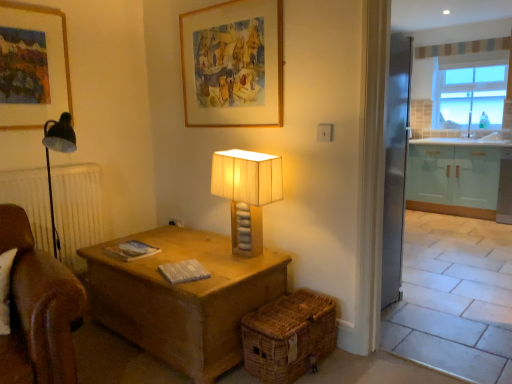
Question: From the image's perspective, is white glossy sink at right on clear glass window at upper right?

Choices:
 (A) no
 (B) yes

Answer: (A)

Question: Can we say white glossy sink at right lies outside clear glass window at upper right?

Choices:
 (A) yes
 (B) no

Answer: (A)

Question: Is white glossy sink at right closer to camera compared to clear glass window at upper right?

Choices:
 (A) yes
 (B) no

Answer: (A)

Question: Is white glossy sink at right positioned with its back to clear glass window at upper right?

Choices:
 (A) no
 (B) yes

Answer: (A)

Question: Can you confirm if white glossy sink at right is shorter than clear glass window at upper right?

Choices:
 (A) yes
 (B) no

Answer: (A)

Question: Is clear glass window at upper right taller or shorter than wooden table lamp at center?

Choices:
 (A) tall
 (B) short

Answer: (A)

Question: Considering their positions, is clear glass window at upper right located in front of or behind wooden table lamp at center?

Choices:
 (A) behind
 (B) front

Answer: (A)

Question: In terms of width, does clear glass window at upper right look wider or thinner when compared to wooden table lamp at center?

Choices:
 (A) thin
 (B) wide

Answer: (B)

Question: From a real-world perspective, is clear glass window at upper right physically located above or below wooden table lamp at center?

Choices:
 (A) below
 (B) above

Answer: (B)

Question: From a real-world perspective, is woven brown basket at lower center positioned above or below white glossy sink at right?

Choices:
 (A) above
 (B) below

Answer: (B)

Question: In terms of size, does woven brown basket at lower center appear bigger or smaller than white glossy sink at right?

Choices:
 (A) small
 (B) big

Answer: (B)

Question: Considering the positions of woven brown basket at lower center and white glossy sink at right in the image, is woven brown basket at lower center wider or thinner than white glossy sink at right?

Choices:
 (A) thin
 (B) wide

Answer: (B)

Question: Would you say woven brown basket at lower center is to the left or to the right of white glossy sink at right in the picture?

Choices:
 (A) left
 (B) right

Answer: (A)

Question: Relative to clear glass window at upper right, is woven brown basket at lower center in front or behind?

Choices:
 (A) front
 (B) behind

Answer: (A)

Question: Is woven brown basket at lower center to the left or to the right of clear glass window at upper right in the image?

Choices:
 (A) right
 (B) left

Answer: (B)